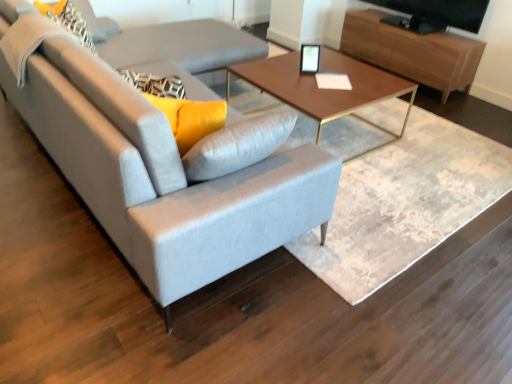
Question: Should I look upward or downward to see wooden entertainment center at upper right?

Choices:
 (A) down
 (B) up

Answer: (B)

Question: From a real-world perspective, is matte black picture frame at center located higher than black glossy tv at upper right?

Choices:
 (A) no
 (B) yes

Answer: (A)

Question: Does matte black picture frame at center have a lesser height compared to black glossy tv at upper right?

Choices:
 (A) no
 (B) yes

Answer: (B)

Question: Is the depth of matte black picture frame at center greater than that of black glossy tv at upper right?

Choices:
 (A) no
 (B) yes

Answer: (A)

Question: Can you confirm if matte black picture frame at center is taller than black glossy tv at upper right?

Choices:
 (A) no
 (B) yes

Answer: (A)

Question: Could you tell me if matte black picture frame at center is facing black glossy tv at upper right?

Choices:
 (A) no
 (B) yes

Answer: (A)

Question: Is matte black picture frame at center looking in the opposite direction of black glossy tv at upper right?

Choices:
 (A) no
 (B) yes

Answer: (A)

Question: Is matte black picture frame at center aimed at light gray fabric couch at center?

Choices:
 (A) yes
 (B) no

Answer: (B)

Question: From a real-world perspective, is matte black picture frame at center positioned over light gray fabric couch at center based on gravity?

Choices:
 (A) yes
 (B) no

Answer: (A)

Question: From the image's perspective, is matte black picture frame at center located above light gray fabric couch at center?

Choices:
 (A) no
 (B) yes

Answer: (B)

Question: Is light gray fabric couch at center a part of matte black picture frame at center?

Choices:
 (A) yes
 (B) no

Answer: (B)

Question: Is matte black picture frame at center positioned beyond the bounds of light gray fabric couch at center?

Choices:
 (A) no
 (B) yes

Answer: (B)

Question: Is matte black picture frame at center at the right side of light gray fabric couch at center?

Choices:
 (A) no
 (B) yes

Answer: (B)

Question: Is light gray fabric couch at center placed right next to black glossy tv at upper right?

Choices:
 (A) yes
 (B) no

Answer: (B)